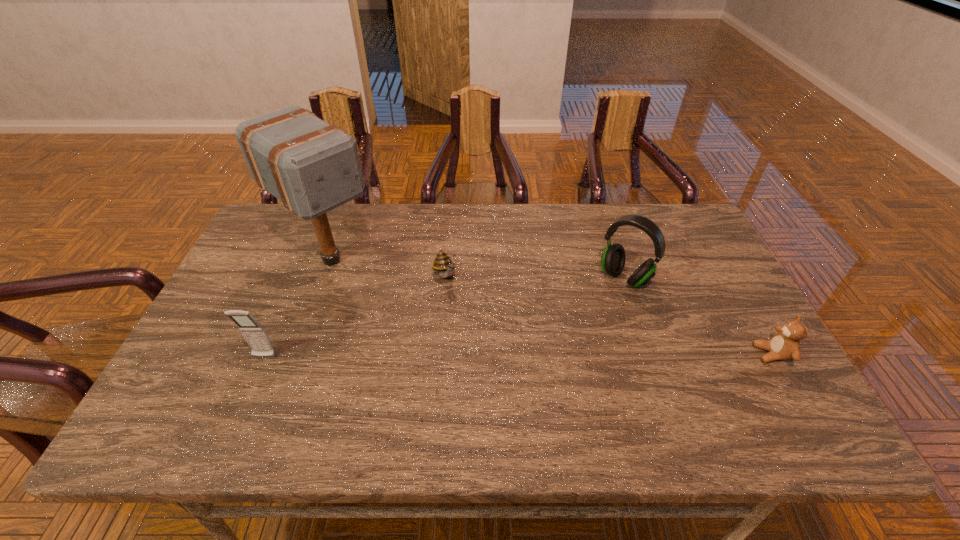
This screenshot has height=540, width=960. Identify the location of cellular telephone. (255, 335).

Find the location of a particular element. the rightmost object is located at coordinates (785, 345).

This screenshot has height=540, width=960. Find the location of `mallet`. mallet is located at coordinates (311, 166).

Locate an element on the screen. Image resolution: width=960 pixels, height=540 pixels. the second object from right to left is located at coordinates (613, 259).

This screenshot has height=540, width=960. Identify the location of the third object from right to left. (445, 265).

Where is `free spot located on the front-facing side of the cellular telephone`? The width and height of the screenshot is (960, 540). free spot located on the front-facing side of the cellular telephone is located at coordinates (249, 394).

I want to click on free spot located 0.310m on the front-facing side of the rightmost object, so click(629, 354).

Locate an element on the screen. This screenshot has width=960, height=540. vacant space positioned 0.050m on the front-facing side of the rightmost object is located at coordinates (735, 354).

Identify the location of free space located 0.160m on the front-facing side of the rightmost object. Image resolution: width=960 pixels, height=540 pixels. (690, 354).

The height and width of the screenshot is (540, 960). Find the location of `free space located 0.210m on the striking surface of the tallest object`. free space located 0.210m on the striking surface of the tallest object is located at coordinates (408, 323).